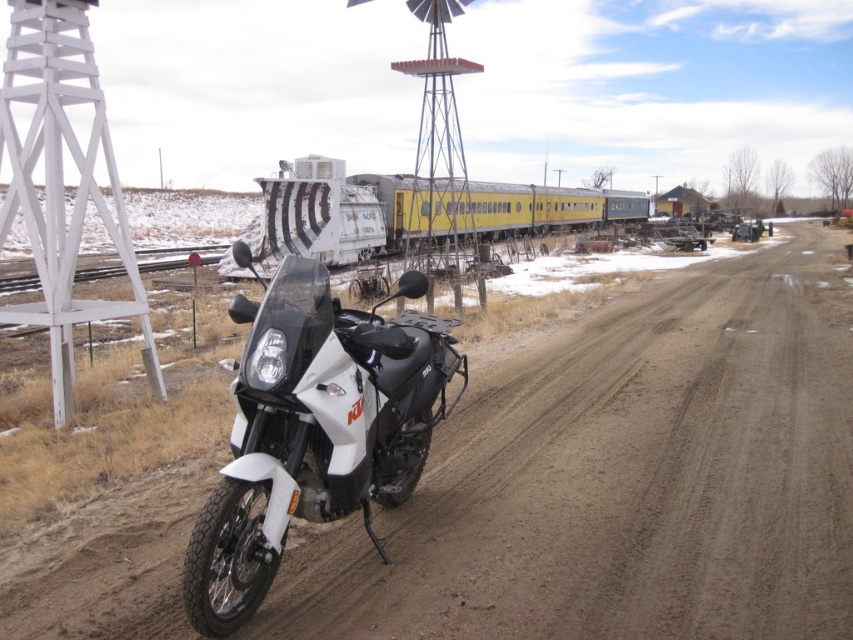
Does dirt track at center appear over white matte/black textured motorbike at center?

Yes.

Locate an element on the screen. This screenshot has height=640, width=853. dirt track at center is located at coordinates (624, 477).

Between point (648, 636) and point (109, 138), which one is positioned in front?

Point (648, 636) is in front.

Which of these two, dirt track at center or white painted wood windmill at left, stands taller?

dirt track at center

Image resolution: width=853 pixels, height=640 pixels. Identify the location of dirt track at center. (624, 477).

Can you confirm if white painted wood windmill at left is wider than yellow matte train car at center?

Incorrect, white painted wood windmill at left's width does not surpass yellow matte train car at center's.

Who is more forward, (59, 396) or (283, 186)?

Point (59, 396)

Identify the location of white painted wood windmill at left. (61, 182).